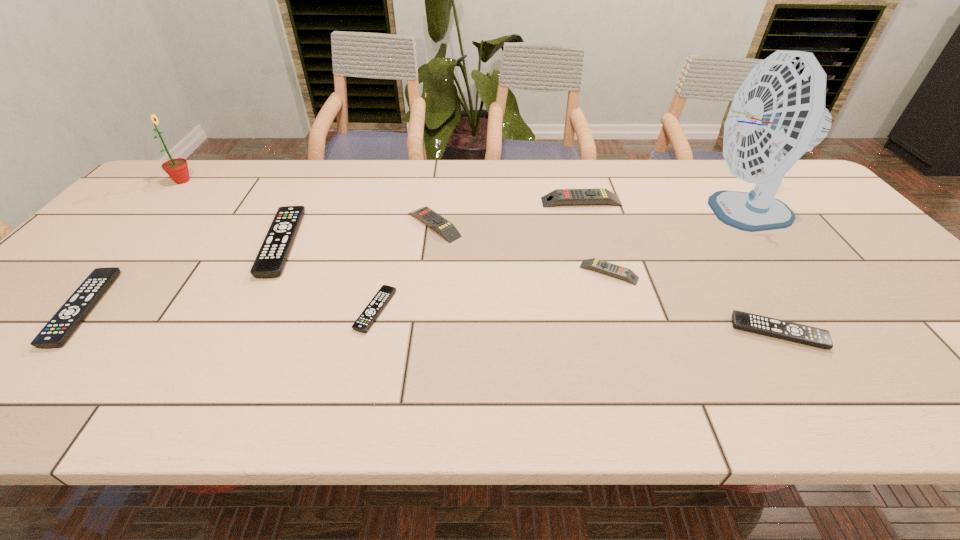
Identify the location of sunflower present at the left edge. (177, 169).

This screenshot has height=540, width=960. Identify the location of remote control that is at the left edge. click(62, 325).

What are the coordinates of `object that is positioned at the right edge` in the screenshot? It's located at (778, 113).

Where is `object that is positioned at the far left corner`? The width and height of the screenshot is (960, 540). object that is positioned at the far left corner is located at coordinates (177, 169).

Locate an element on the screen. object situated at the far right corner is located at coordinates (778, 113).

At what (x,y) coordinates should I click in order to perform the action: click on free location at the far edge of the desktop. Please return your answer as a coordinate pair (x, y). This screenshot has height=540, width=960. Looking at the image, I should click on (610, 163).

You are a GUI agent. You are given a task and a screenshot of the screen. Output one action in this format:
    pyautogui.click(x=<x>, y=<y>)
    Task: Click on the vacant space at the near edge of the desktop
    
    Given the screenshot: What is the action you would take?
    pyautogui.click(x=617, y=386)

In the image, there is a desktop. Identify the location of free region at the left edge. (78, 287).

I want to click on free region at the right edge of the desktop, so click(882, 264).

At what (x,y) coordinates should I click in order to perform the action: click on vacant space at the far left corner of the desktop. Please return your answer as a coordinate pair (x, y). The height and width of the screenshot is (540, 960). Looking at the image, I should click on click(179, 198).